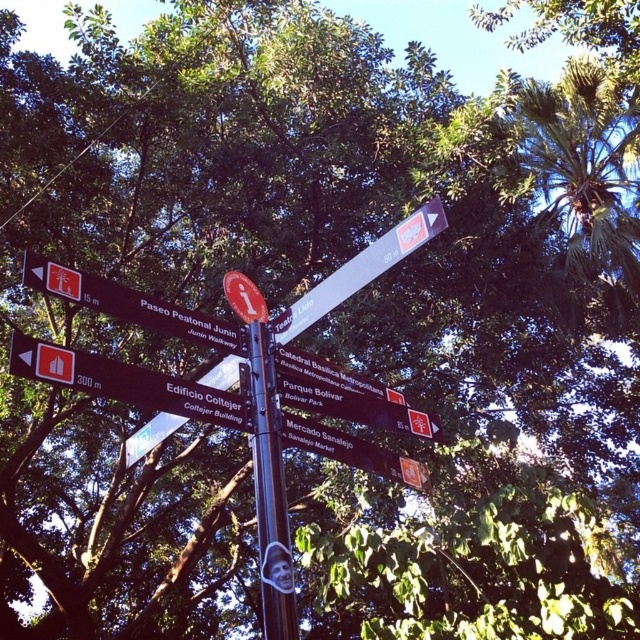
What do you see at coordinates (124, 381) in the screenshot? The width and height of the screenshot is (640, 640). I see `matte brown sign at lower left` at bounding box center [124, 381].

Can you confirm if matte brown sign at lower left is positioned to the right of metallic pole at center?

In fact, matte brown sign at lower left is to the left of metallic pole at center.

Which is in front, point (163, 387) or point (256, 492)?

Point (163, 387) is in front.

Where is `matte brown sign at lower left`? The height and width of the screenshot is (640, 640). matte brown sign at lower left is located at coordinates (124, 381).

Does point (61, 349) lie in front of point (432, 221)?

Yes, it is in front of point (432, 221).

Can you confirm if matte brown sign at lower left is taller than white plastic sign at upper center?

No, matte brown sign at lower left is not taller than white plastic sign at upper center.

Image resolution: width=640 pixels, height=640 pixels. In order to click on matte brown sign at lower left in this screenshot , I will do `click(124, 381)`.

Is point (129, 308) farther from viewer compared to point (323, 300)?

No, (129, 308) is in front of (323, 300).

Can you confirm if white plastic sign at upper left is bigger than white plastic sign at upper center?

No, white plastic sign at upper left is not bigger than white plastic sign at upper center.

Is point (173, 324) closer to camera compared to point (365, 273)?

Yes, it is in front of point (365, 273).

The image size is (640, 640). Identify the location of white plastic sign at upper left. (131, 305).